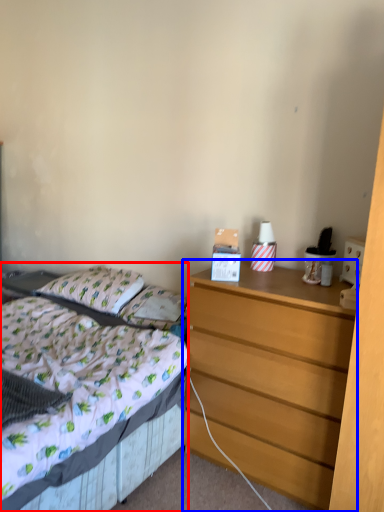
Question: Which of the following is the closest to the observer, bed (highlighted by a red box) or chest of drawers (highlighted by a blue box)?

Choices:
 (A) bed
 (B) chest of drawers

Answer: (A)